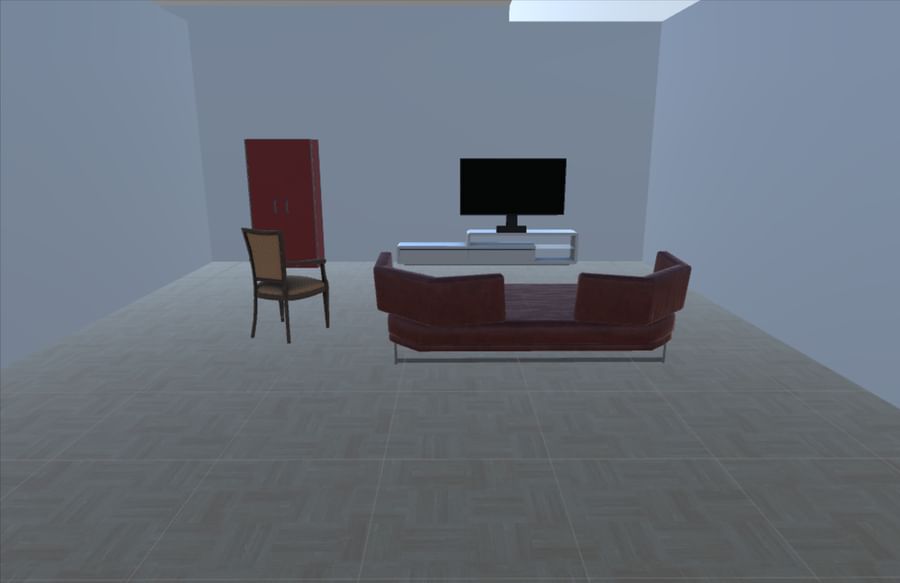
At what (x,y) coordinates should I click in order to perform the action: click on light. Please return your answer as a coordinate pair (x, y). Looking at the image, I should click on (299, 469), (612, 7).